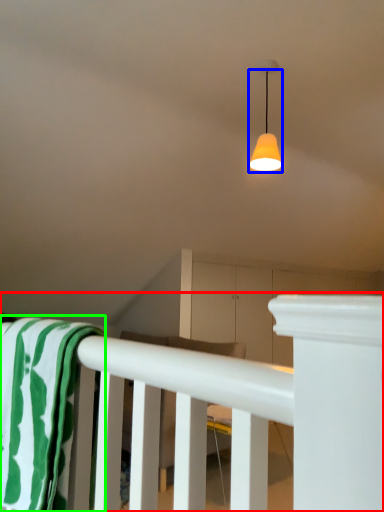
Question: Which object is positioned closest to rail (highlighted by a red box)? Select from lamp (highlighted by a blue box) and beach towel (highlighted by a green box).

Choices:
 (A) lamp
 (B) beach towel

Answer: (B)